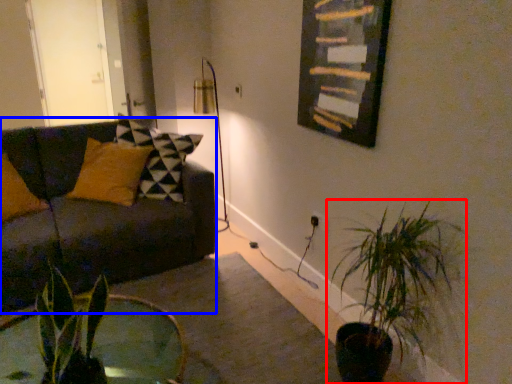
Question: Which object is further to the camera taking this photo, houseplant (highlighted by a red box) or studio couch (highlighted by a blue box)?

Choices:
 (A) houseplant
 (B) studio couch

Answer: (B)